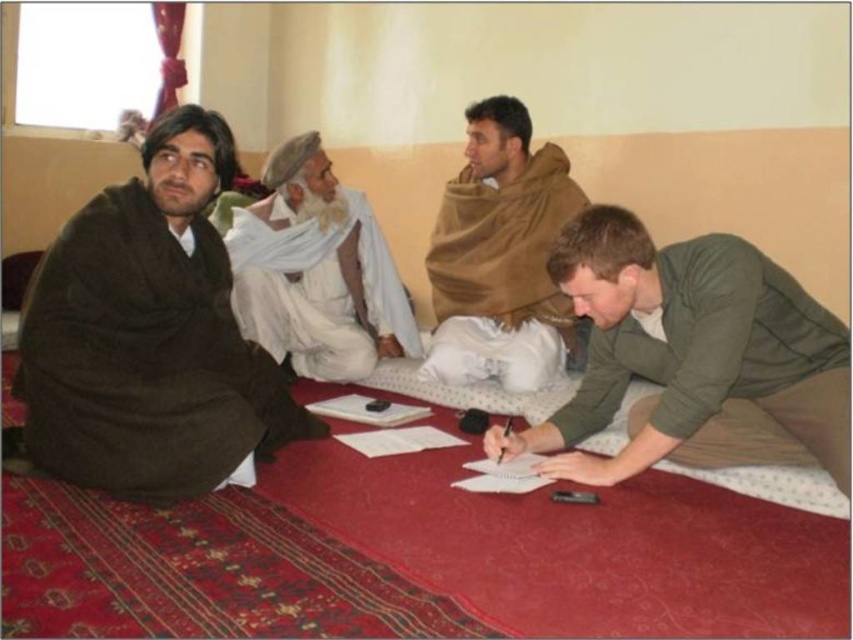
Looking at this image, is brown woolen robe at left wider than green matte shirt at lower right?

Indeed, brown woolen robe at left has a greater width compared to green matte shirt at lower right.

Is brown woolen robe at left bigger than green matte shirt at lower right?

Yes.

Between point (47, 369) and point (721, 288), which one is positioned behind?

The point (47, 369) is behind.

Where is `brown woolen robe at left`? brown woolen robe at left is located at coordinates 144,358.

Can you confirm if brown woolen robe at left is thinner than brown woolen shawl at upper center?

No, brown woolen robe at left is not thinner than brown woolen shawl at upper center.

What do you see at coordinates (144, 358) in the screenshot? I see `brown woolen robe at left` at bounding box center [144, 358].

What are the coordinates of `brown woolen robe at left` in the screenshot? It's located at (144, 358).

Looking at this image, is brown woolen robe at left shorter than white cotton turban at center?

Yes.

Based on the photo, which is below, brown woolen robe at left or white cotton turban at center?

brown woolen robe at left is lower down.

Locate an element on the screen. The height and width of the screenshot is (640, 853). brown woolen robe at left is located at coordinates (144, 358).